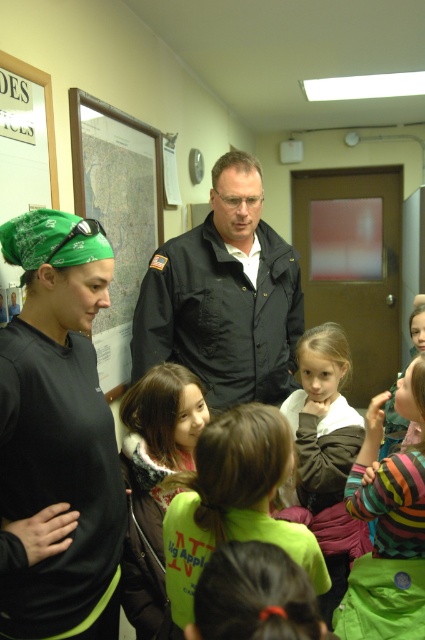
Does green fabric shirt at center have a smaller size compared to matte map at upper left?

Yes, green fabric shirt at center is smaller than matte map at upper left.

At what (x,y) coordinates should I click in order to perform the action: click on green fabric shirt at center. Please return your answer as a coordinate pair (x, y). Image resolution: width=425 pixels, height=640 pixels. Looking at the image, I should click on (232, 502).

Which is behind, point (226, 417) or point (112, 209)?

The point (112, 209) is behind.

Image resolution: width=425 pixels, height=640 pixels. I want to click on green fabric shirt at center, so click(232, 502).

Is dark gray uniform at center above green fabric shirt at center?

Yes.

From the picture: Is dark gray uniform at center wider than green fabric shirt at center?

Correct, the width of dark gray uniform at center exceeds that of green fabric shirt at center.

Is point (217, 176) in front of point (266, 518)?

No, it is behind (266, 518).

The width and height of the screenshot is (425, 640). In order to click on dark gray uniform at center in this screenshot , I will do `click(224, 298)`.

Is the position of dark gray uniform at center more distant than that of striped fabric shirt at center?

Yes, it is behind striped fabric shirt at center.

Is point (252, 173) farther from camera compared to point (424, 602)?

Yes, point (252, 173) is behind point (424, 602).

Is point (217, 204) less distant than point (422, 525)?

No, it is not.

Where is `dark gray uniform at center`? The image size is (425, 640). dark gray uniform at center is located at coordinates (224, 298).